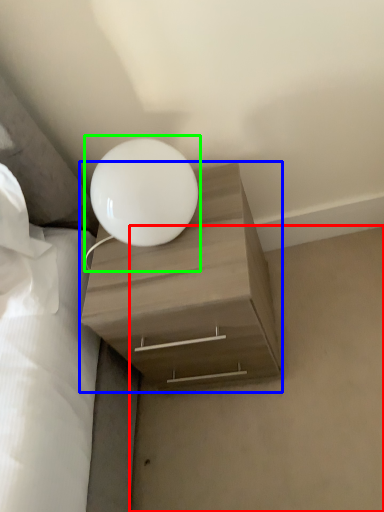
Question: Estimate the real-world distances between objects in this image. Which object is farther from concrete (highlighted by a red box), nightstand (highlighted by a blue box) or lamp (highlighted by a green box)?

Choices:
 (A) nightstand
 (B) lamp

Answer: (B)